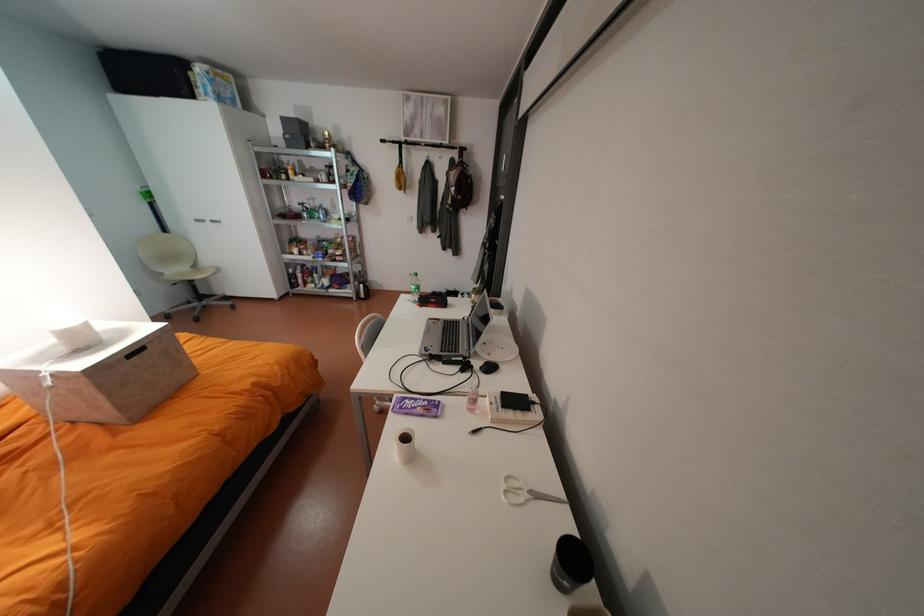
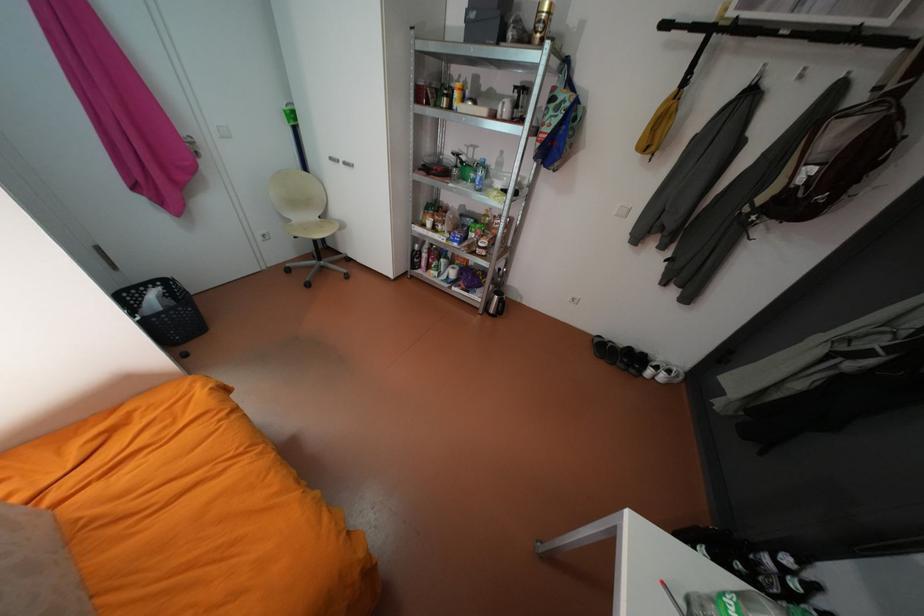
Find the pixel in the second image that matches (321,217) in the first image.

(471, 177)